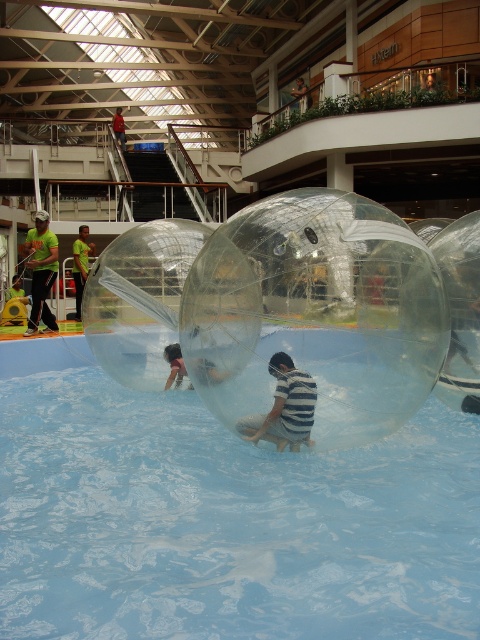
Is point (254, 360) closer to viewer compared to point (304, 88)?

That is True.

Can you confirm if transparent/inflatable bubble at center is positioned above smooth skin person at upper center?

No.

Describe the element at coordinates (315, 312) in the screenshot. The height and width of the screenshot is (640, 480). I see `transparent/inflatable bubble at center` at that location.

Where is `transparent/inflatable bubble at center`? Image resolution: width=480 pixels, height=640 pixels. transparent/inflatable bubble at center is located at coordinates (315, 312).

Does transparent/inflatable bubble at center appear under green fabric shirt at left?

Yes, transparent/inflatable bubble at center is below green fabric shirt at left.

Is point (339, 355) more distant than point (35, 266)?

No, it is in front of (35, 266).

Find the location of a particular element. The height and width of the screenshot is (640, 480). transparent/inflatable bubble at center is located at coordinates (315, 312).

Does green t-shirt at left appear on the left side of green t-shirt at upper center?

In fact, green t-shirt at left is to the right of green t-shirt at upper center.

Who is higher up, green t-shirt at left or green t-shirt at upper center?

Positioned higher is green t-shirt at upper center.

Is point (81, 236) farther from viewer compared to point (121, 145)?

No, (81, 236) is in front of (121, 145).

The width and height of the screenshot is (480, 640). What are the coordinates of `green t-shirt at left` in the screenshot? It's located at (x=81, y=264).